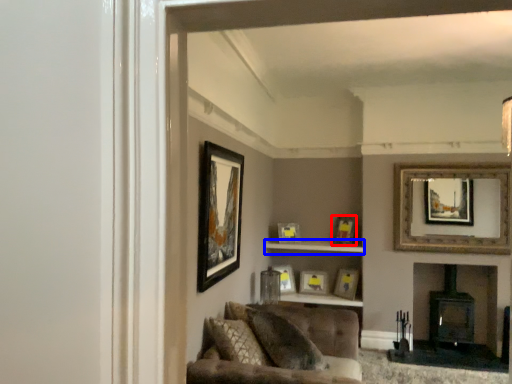
Question: Which object is closer to the camera taking this photo, picture frame (highlighted by a red box) or cabinet (highlighted by a blue box)?

Choices:
 (A) picture frame
 (B) cabinet

Answer: (B)